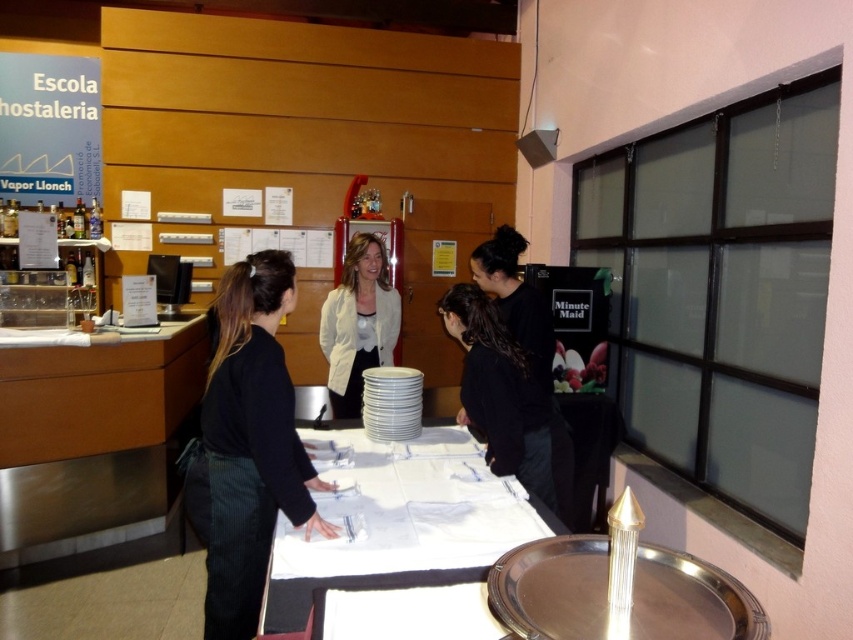
Does black corduroy pants at center have a greater height compared to white cloth at center?

Yes, black corduroy pants at center is taller than white cloth at center.

Does black corduroy pants at center have a greater width compared to white cloth at center?

Incorrect, black corduroy pants at center's width does not surpass white cloth at center's.

Between point (213, 636) and point (277, 611), which one is positioned behind?

The point (213, 636) is more distant.

Where is `black corduroy pants at center`? black corduroy pants at center is located at coordinates (251, 444).

Does black corduroy pants at center appear on the left side of white matte jacket at center?

Indeed, black corduroy pants at center is positioned on the left side of white matte jacket at center.

Is black corduroy pants at center bigger than white matte jacket at center?

Correct, black corduroy pants at center is larger in size than white matte jacket at center.

Locate an element on the screen. black corduroy pants at center is located at coordinates (251, 444).

Identify the location of black corduroy pants at center. (251, 444).

Who is shorter, black corduroy pants at center or black matte jacket at center?

Standing shorter between the two is black matte jacket at center.

Is black corduroy pants at center smaller than black matte jacket at center?

No, black corduroy pants at center is not smaller than black matte jacket at center.

Between point (244, 396) and point (514, 353), which one is positioned behind?

The point (514, 353) is more distant.

Locate an element on the screen. black corduroy pants at center is located at coordinates (251, 444).